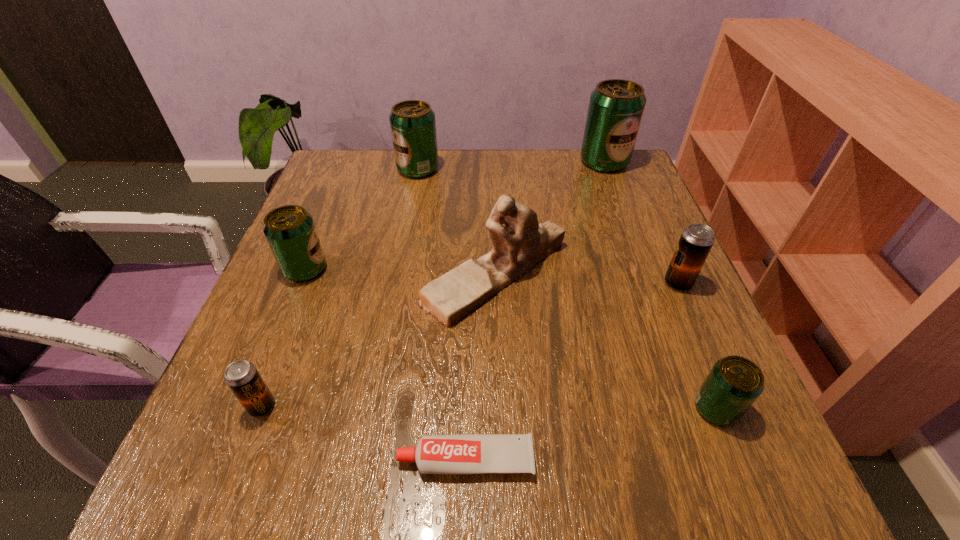
I want to click on blank space located on the left of the smallest green beer can, so click(512, 409).

Find the location of `free space located 0.270m on the right of the left black beer can`. free space located 0.270m on the right of the left black beer can is located at coordinates (450, 406).

Locate an element on the screen. The width and height of the screenshot is (960, 540). vacant space located on the left of the toothpaste is located at coordinates (285, 459).

This screenshot has height=540, width=960. What are the coordinates of `object present at the near edge` in the screenshot? It's located at (472, 453).

Image resolution: width=960 pixels, height=540 pixels. Find the location of `object located at the far right corner`. object located at the far right corner is located at coordinates [x=616, y=106].

This screenshot has width=960, height=540. In order to click on vacant space at the far edge in this screenshot , I will do `click(533, 179)`.

Where is `free space at the near edge of the desktop`? The height and width of the screenshot is (540, 960). free space at the near edge of the desktop is located at coordinates (634, 471).

I want to click on vacant space at the left edge of the desktop, so click(359, 247).

Where is `vacant space at the right edge of the desktop`? This screenshot has width=960, height=540. vacant space at the right edge of the desktop is located at coordinates (704, 349).

Where is `free space at the far left corner of the desktop`? This screenshot has height=540, width=960. free space at the far left corner of the desktop is located at coordinates (346, 177).